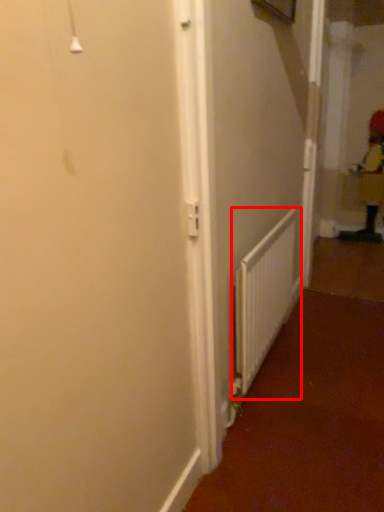
Question: In this image, where is radiator (annotated by the red box) located relative to worker?

Choices:
 (A) left
 (B) right

Answer: (A)